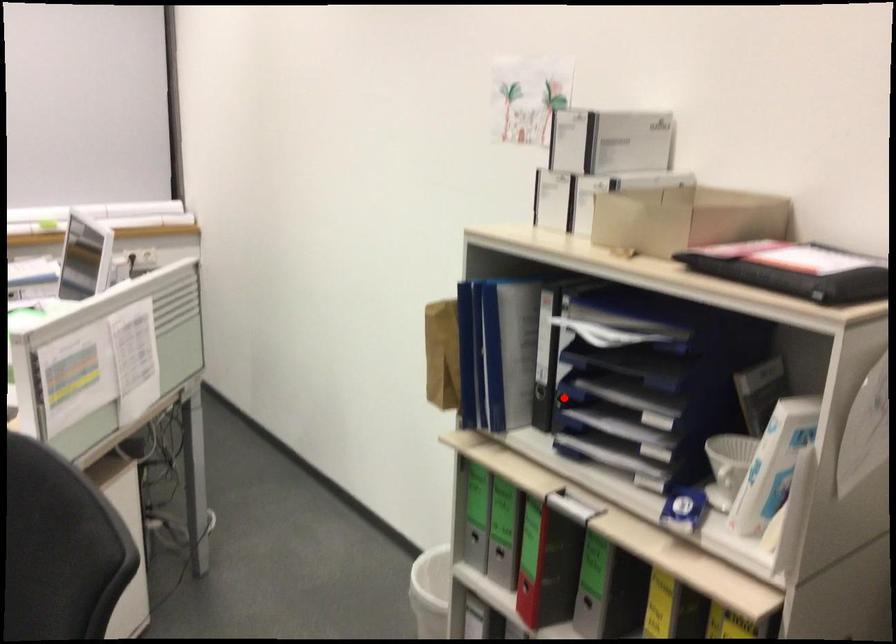
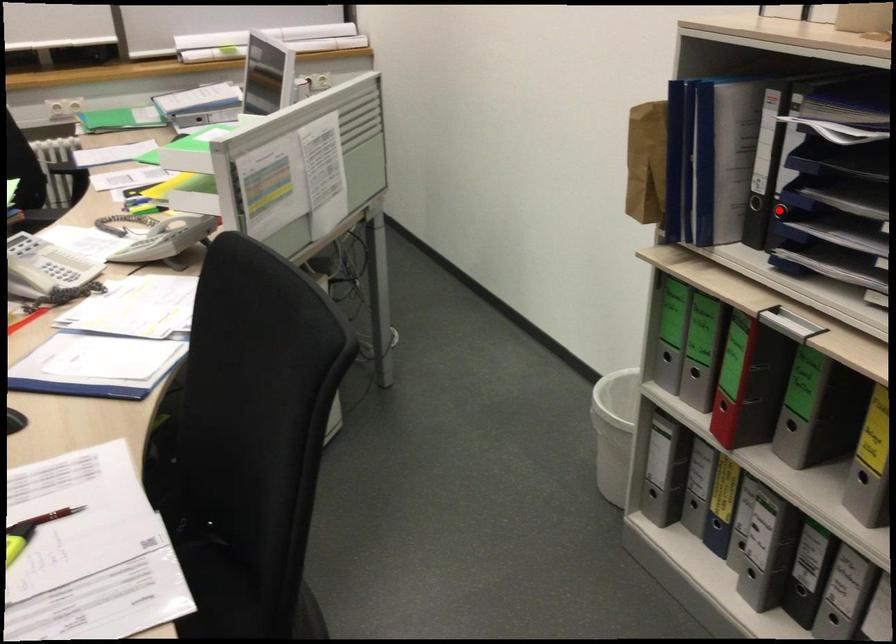
I am providing you with two images of the same scene from different viewpoints. A red point is marked on the first image and another point is marked on the second image. Is the red point in image1 aligned with the point shown in image2?

Yes